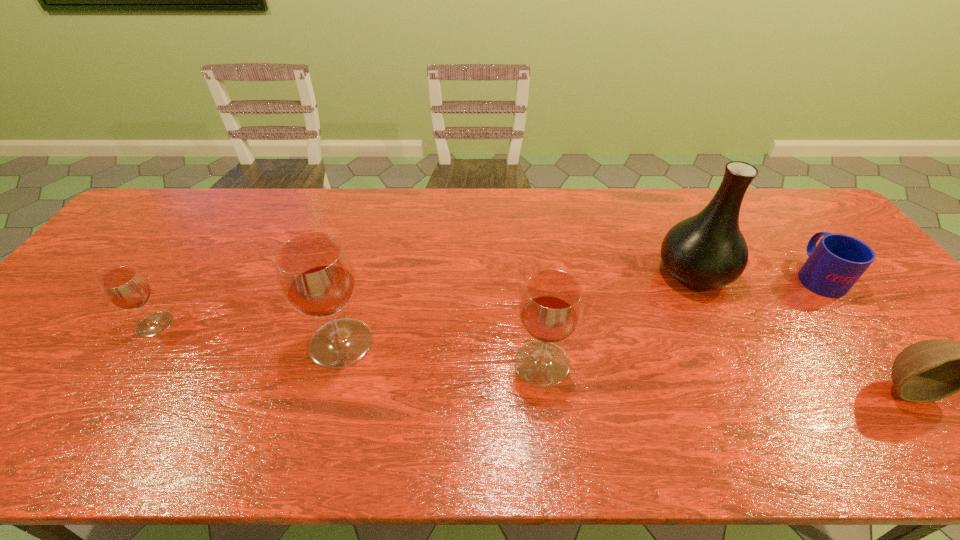
I want to click on object positioned at the near right corner, so click(931, 370).

Where is `vacant space at the far edge of the desktop`? The height and width of the screenshot is (540, 960). vacant space at the far edge of the desktop is located at coordinates (567, 227).

At what (x,y) coordinates should I click in order to perform the action: click on vacant space at the near edge. Please return your answer as a coordinate pair (x, y). The height and width of the screenshot is (540, 960). Looking at the image, I should click on (262, 402).

Where is `free point between the vase and the second tallest wineglass`? Image resolution: width=960 pixels, height=540 pixels. free point between the vase and the second tallest wineglass is located at coordinates (618, 318).

What are the coordinates of `empty space that is in between the vase and the shortest object` in the screenshot? It's located at click(x=756, y=274).

Find the location of a particular element. vacant space that's between the rightmost wineglass and the second object from left to right is located at coordinates (442, 353).

You are a GUI agent. You are given a task and a screenshot of the screen. Output one action in this format:
    pyautogui.click(x=<x>, y=<y>)
    Task: Click on the vacant area that lies between the third object from right to left and the bowl
    Image resolution: width=960 pixels, height=540 pixels.
    Given the screenshot: What is the action you would take?
    pyautogui.click(x=800, y=329)

Where is `free spot between the mug and the fourth shortest object`? free spot between the mug and the fourth shortest object is located at coordinates (680, 320).

Locate an element on the screen. Image resolution: width=960 pixels, height=540 pixels. free spot between the mug and the bowl is located at coordinates (862, 332).

Where is `free space between the vase and the mug`? This screenshot has width=960, height=540. free space between the vase and the mug is located at coordinates (756, 274).